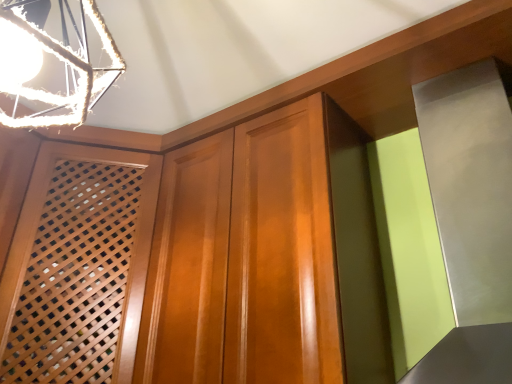
Question: Considering the positions of wooden lattice screen at left and metallic rope at upper left in the image, is wooden lattice screen at left bigger or smaller than metallic rope at upper left?

Choices:
 (A) small
 (B) big

Answer: (B)

Question: Is wooden lattice screen at left inside or outside of metallic rope at upper left?

Choices:
 (A) outside
 (B) inside

Answer: (A)

Question: Considering the positions of wooden lattice screen at left and metallic rope at upper left in the image, is wooden lattice screen at left wider or thinner than metallic rope at upper left?

Choices:
 (A) thin
 (B) wide

Answer: (B)

Question: From their relative heights in the image, would you say metallic rope at upper left is taller or shorter than wooden lattice screen at left?

Choices:
 (A) tall
 (B) short

Answer: (B)

Question: Is point [x=88, y=89] positioned closer to the camera than point [x=29, y=321]?

Choices:
 (A) farther
 (B) closer

Answer: (B)

Question: Relative to wooden lattice screen at left, is metallic rope at upper left in front or behind?

Choices:
 (A) behind
 (B) front

Answer: (B)

Question: Is metallic rope at upper left spatially inside wooden lattice screen at left, or outside of it?

Choices:
 (A) outside
 (B) inside

Answer: (A)